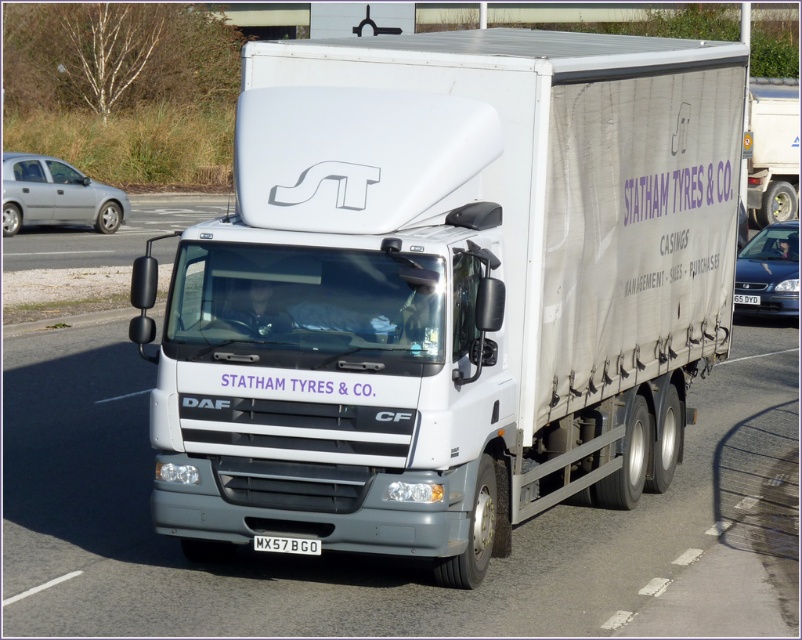
Question: Can you confirm if white matte trailer truck at center is positioned to the left of silver metallic sedan at left?

Choices:
 (A) yes
 (B) no

Answer: (B)

Question: Which of the following is the farthest from the observer?

Choices:
 (A) white matte trailer truck at center
 (B) silver metallic sedan at left
 (C) white canvas truck at center

Answer: (B)

Question: Which point appears closest to the camera in this image?

Choices:
 (A) (774, 236)
 (B) (39, 161)
 (C) (760, 216)

Answer: (A)

Question: In this image, where is white matte trailer truck at center located relative to white canvas truck at center?

Choices:
 (A) above
 (B) below

Answer: (B)

Question: Based on their relative distances, which object is farther from the white plastic license plate at center?

Choices:
 (A) white canvas truck at center
 (B) black metal license plate at center
 (C) metallic blue sedan at right

Answer: (A)

Question: Is silver metallic sedan at left positioned in front of black metal license plate at center?

Choices:
 (A) yes
 (B) no

Answer: (B)